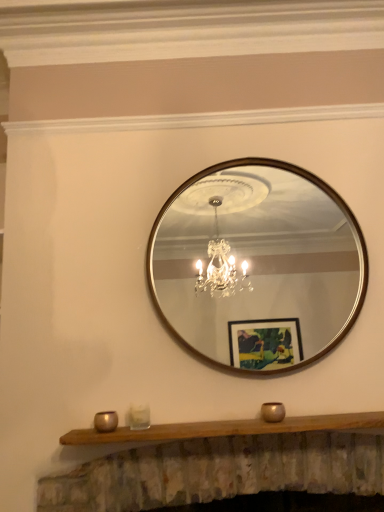
Question: Is wooden mantle at center not within clear glass candle holder at lower center, which is counted as the 2th candle holder, starting from the right?

Choices:
 (A) no
 (B) yes

Answer: (B)

Question: From the image's perspective, is wooden mantle at center on clear glass candle holder at lower center, which is counted as the 2th candle holder, starting from the right?

Choices:
 (A) no
 (B) yes

Answer: (A)

Question: Is wooden mantle at center positioned with its back to clear glass candle holder at lower center, which is counted as the 2th candle holder, starting from the right?

Choices:
 (A) no
 (B) yes

Answer: (A)

Question: Does wooden mantle at center come in front of clear glass candle holder at lower center, which appears as the second candle holder when viewed from the left?

Choices:
 (A) yes
 (B) no

Answer: (A)

Question: Can you confirm if wooden mantle at center is positioned to the right of clear glass candle holder at lower center, which appears as the second candle holder when viewed from the left?

Choices:
 (A) yes
 (B) no

Answer: (A)

Question: From the image's perspective, is gold metallic candle holder at lower center, the first candle holder when ordered from right to left, located above or below wooden-framed mirror at center?

Choices:
 (A) below
 (B) above

Answer: (A)

Question: Looking at the image, does gold metallic candle holder at lower center, the first candle holder when ordered from right to left, seem bigger or smaller compared to wooden-framed mirror at center?

Choices:
 (A) big
 (B) small

Answer: (B)

Question: Relative to wooden-framed mirror at center, is gold metallic candle holder at lower center, marked as the third candle holder in a left-to-right arrangement, in front or behind?

Choices:
 (A) front
 (B) behind

Answer: (A)

Question: Considering the positions of gold metallic candle holder at lower center, marked as the third candle holder in a left-to-right arrangement, and wooden-framed mirror at center in the image, is gold metallic candle holder at lower center, marked as the third candle holder in a left-to-right arrangement, taller or shorter than wooden-framed mirror at center?

Choices:
 (A) tall
 (B) short

Answer: (B)

Question: Choose the correct answer: Is gold metallic candle holder at lower center, marked as the third candle holder in a left-to-right arrangement, inside metallic gold candle holder at lower center, arranged as the third candle holder when viewed from the right, or outside it?

Choices:
 (A) outside
 (B) inside

Answer: (A)

Question: From a real-world perspective, is gold metallic candle holder at lower center, marked as the third candle holder in a left-to-right arrangement, positioned above or below metallic gold candle holder at lower center, which is the 1th candle holder in left-to-right order?

Choices:
 (A) above
 (B) below

Answer: (B)

Question: In terms of height, does gold metallic candle holder at lower center, marked as the third candle holder in a left-to-right arrangement, look taller or shorter compared to metallic gold candle holder at lower center, which is the 1th candle holder in left-to-right order?

Choices:
 (A) short
 (B) tall

Answer: (A)

Question: In the image, is gold metallic candle holder at lower center, marked as the third candle holder in a left-to-right arrangement, positioned in front of or behind metallic gold candle holder at lower center, arranged as the third candle holder when viewed from the right?

Choices:
 (A) behind
 (B) front

Answer: (A)

Question: Considering the positions of wooden-framed mirror at center and clear glass candle holder at lower center, which is counted as the 2th candle holder, starting from the right, in the image, is wooden-framed mirror at center taller or shorter than clear glass candle holder at lower center, which is counted as the 2th candle holder, starting from the right,?

Choices:
 (A) short
 (B) tall

Answer: (B)

Question: Is wooden-framed mirror at center bigger or smaller than clear glass candle holder at lower center, which is counted as the 2th candle holder, starting from the right?

Choices:
 (A) big
 (B) small

Answer: (A)